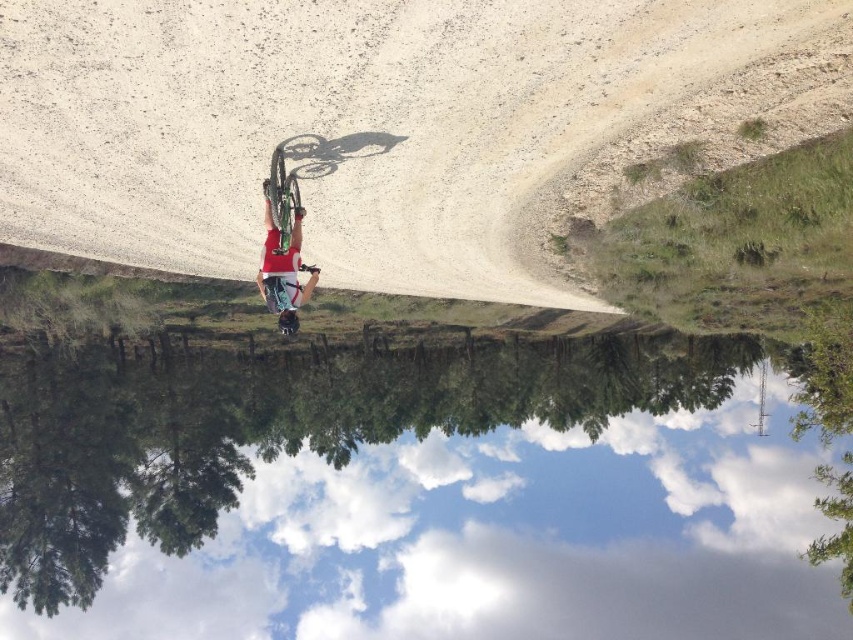
You are a cyclist riding a green matte bicycle at center along a gravel path. You want to reach the transparent glass lake at center. Which direction should you turn to head towards the lake?

The transparent glass lake at center is to the right of the green matte bicycle at center, so you should turn right to head towards the lake.

You are planning to take a photo of the transparent glass lake at center and the brown gravel dirt track at upper center. Which object should you focus on first if you want to capture the larger subject in your frame?

The transparent glass lake at center is larger in size than the brown gravel dirt track at upper center, so you should focus on the transparent glass lake at center first to capture the larger subject in your frame.

You are standing at the starting point of the brown gravel dirt track at upper center and want to reach the green matte bicycle at center. Which direction should you move to get closer to the bicycle?

Since the brown gravel dirt track at upper center is closer to the viewer than the green matte bicycle at center, you should move forward along the track to get closer to the bicycle.